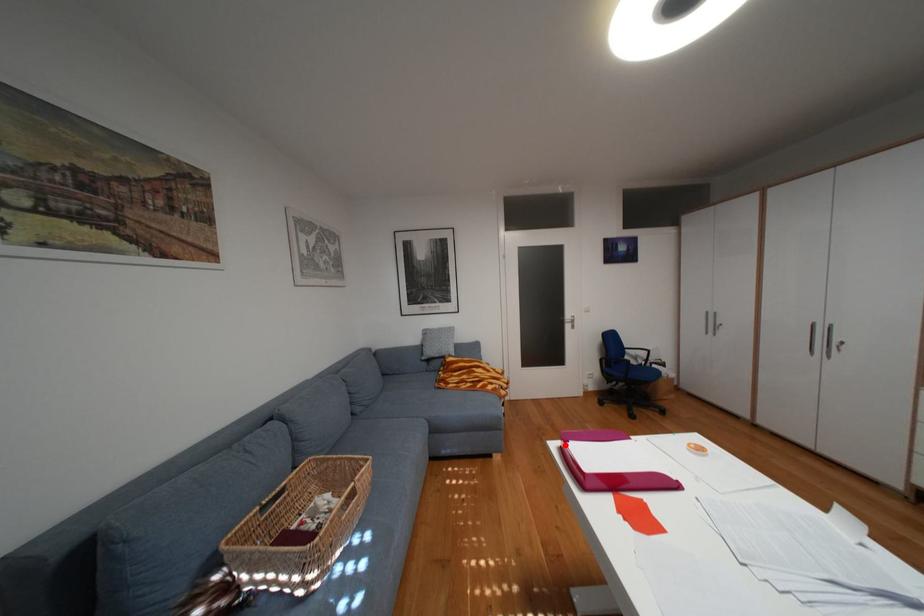
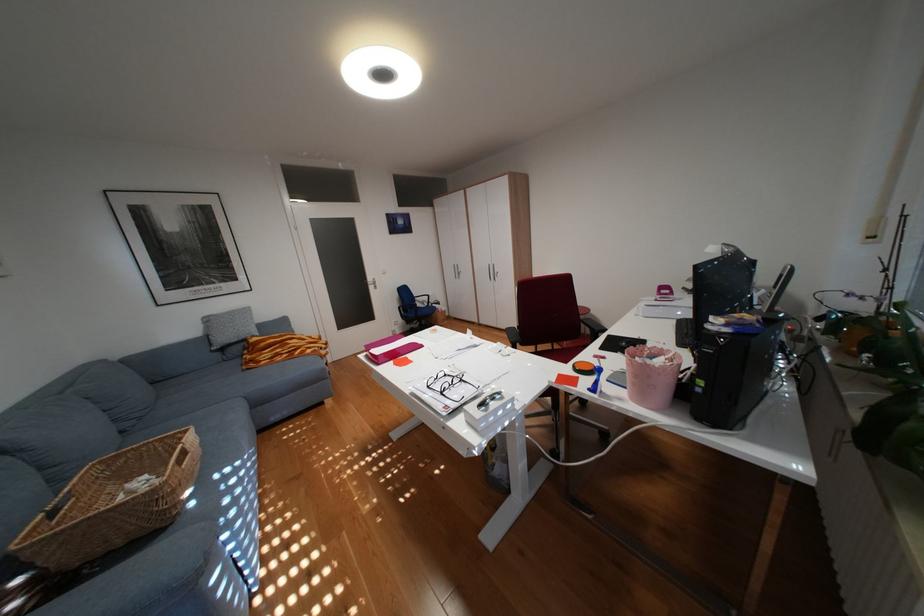
Locate, in the second image, the point that corresponds to the highlighted location in the first image.

(373, 355)